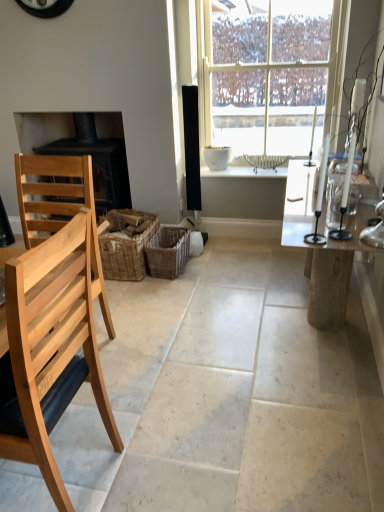
Where is `free space between natural wood chair at left, arranged as the 2th chair when viewed from the front, and clear glass table at right`? The height and width of the screenshot is (512, 384). free space between natural wood chair at left, arranged as the 2th chair when viewed from the front, and clear glass table at right is located at coordinates (206, 324).